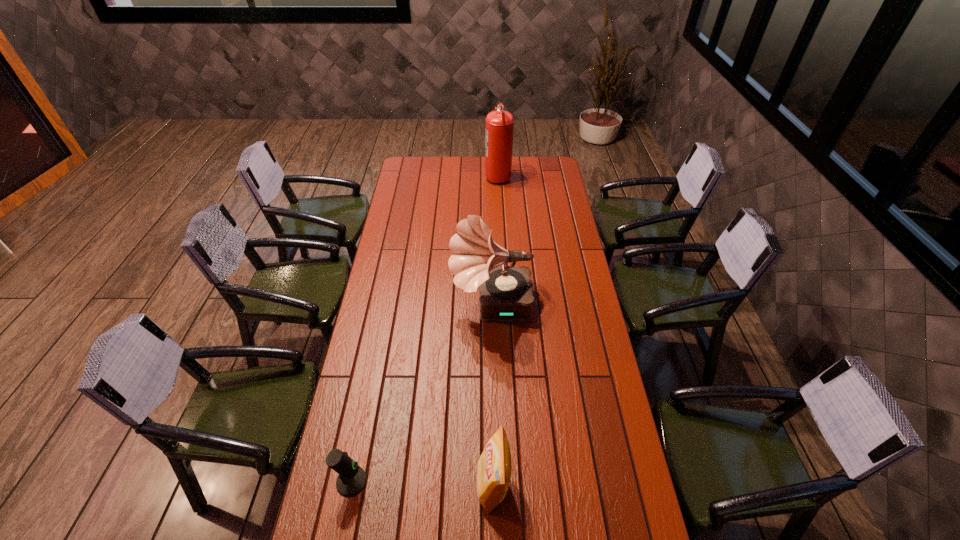
This screenshot has width=960, height=540. What are the coordinates of `free space located 0.110m from the horn of the record player` in the screenshot? It's located at tap(424, 306).

Where is `vacant space located 0.250m on the front-facing side of the crisp (potato chip)`? vacant space located 0.250m on the front-facing side of the crisp (potato chip) is located at coordinates (394, 485).

Locate an element on the screen. The image size is (960, 540). vacant space located on the front-facing side of the crisp (potato chip) is located at coordinates (453, 485).

Locate an element on the screen. This screenshot has height=540, width=960. vacant point located 0.220m on the front-facing side of the crisp (potato chip) is located at coordinates (403, 485).

At what (x,y) coordinates should I click in order to perform the action: click on free spot located 0.260m on the right of the leftmost object. Please return your answer as a coordinate pair (x, y). The width and height of the screenshot is (960, 540). Looking at the image, I should click on (452, 481).

Where is `object at the far edge`? object at the far edge is located at coordinates (499, 128).

Where is `object present at the left edge`? This screenshot has width=960, height=540. object present at the left edge is located at coordinates (352, 478).

What are the coordinates of `free point at the left edge` in the screenshot? It's located at (372, 398).

In the image, there is a desktop. Identify the location of free space at the right edge. (560, 240).

Locate an element on the screen. This screenshot has height=540, width=960. vacant space at the far right corner is located at coordinates (561, 174).